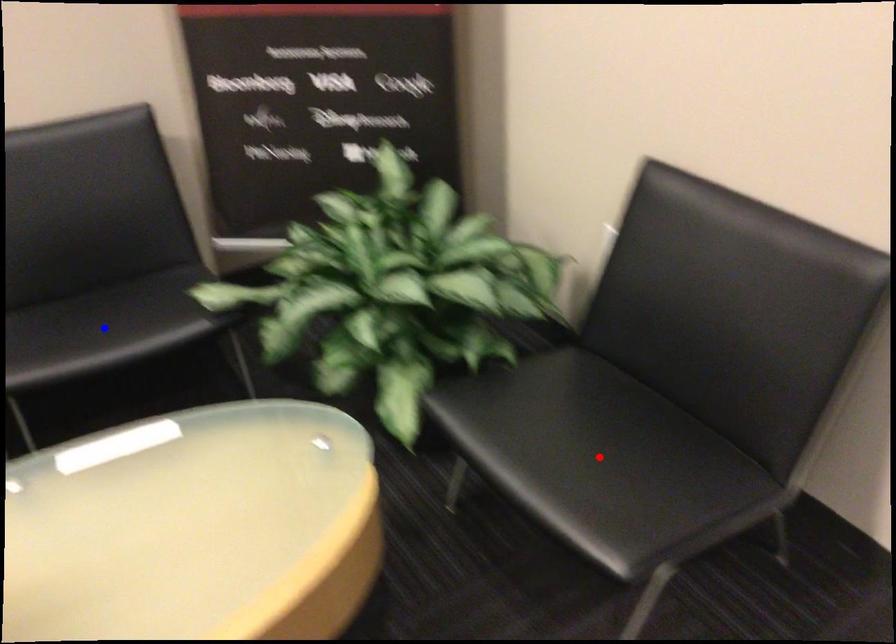
Question: Two points are marked on the image. Which point is closer to the camera?

Choices:
 (A) Blue point is closer.
 (B) Red point is closer.

Answer: (B)